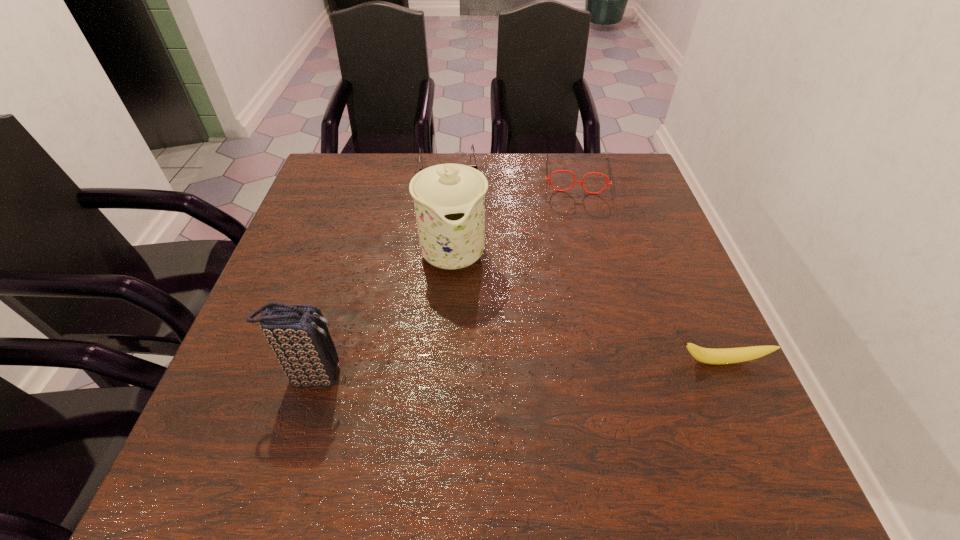
Where is `free location located 0.350m at the front lenses of the sunglasses`? This screenshot has width=960, height=540. free location located 0.350m at the front lenses of the sunglasses is located at coordinates (459, 273).

Identify the location of vacant space located 0.250m at the front lenses of the sunglasses. (456, 245).

Image resolution: width=960 pixels, height=540 pixels. I want to click on free space located 0.310m on the spout of the third nearest object, so click(482, 415).

Locate an element on the screen. The width and height of the screenshot is (960, 540). vacant region located 0.210m on the spout of the third nearest object is located at coordinates (473, 367).

Locate an element on the screen. This screenshot has width=960, height=540. free space located 0.280m on the spout of the third nearest object is located at coordinates (479, 400).

Where is `vacant area located on the front-facing side of the spectacles`? This screenshot has height=540, width=960. vacant area located on the front-facing side of the spectacles is located at coordinates (578, 275).

This screenshot has height=540, width=960. Identify the location of free spot located on the front-facing side of the spectacles. (578, 269).

Image resolution: width=960 pixels, height=540 pixels. Identify the location of vacant space situated on the front-facing side of the spectacles. (577, 213).

Where is `sunglasses situated at the far edge`? The width and height of the screenshot is (960, 540). sunglasses situated at the far edge is located at coordinates (473, 166).

Where is `spectacles situated at the far edge`? The image size is (960, 540). spectacles situated at the far edge is located at coordinates (549, 179).